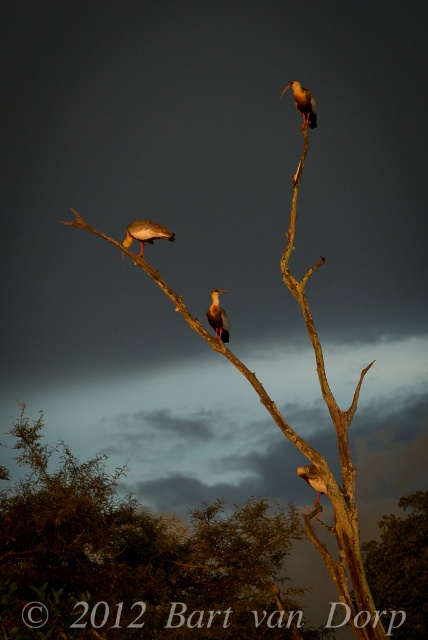
Can you confirm if brown wood tree at upper center is positioned to the left of white feathered bird at center?

No, brown wood tree at upper center is not to the left of white feathered bird at center.

Which is behind, point (332, 484) or point (208, 310)?

Point (208, 310)

Identify the location of brown wood tree at upper center. (297, 435).

Does brown wood tree at upper center appear over matte white bird at upper left?

No.

Does brown wood tree at upper center appear under matte white bird at upper left?

Yes, brown wood tree at upper center is below matte white bird at upper left.

Between point (362, 632) and point (137, 234), which one is positioned in front?

Point (362, 632)

Where is `brown wood tree at upper center`? This screenshot has width=428, height=640. brown wood tree at upper center is located at coordinates (297, 435).

Does matte white bird at upper left have a lesser width compared to white feathered bird at center?

Incorrect, matte white bird at upper left's width is not less than white feathered bird at center's.

Is point (145, 227) in front of point (216, 312)?

Yes, it is.

At what (x,y) coordinates should I click in order to perform the action: click on matte white bird at upper left. Please return your answer as a coordinate pair (x, y). This screenshot has width=428, height=640. Looking at the image, I should click on (145, 232).